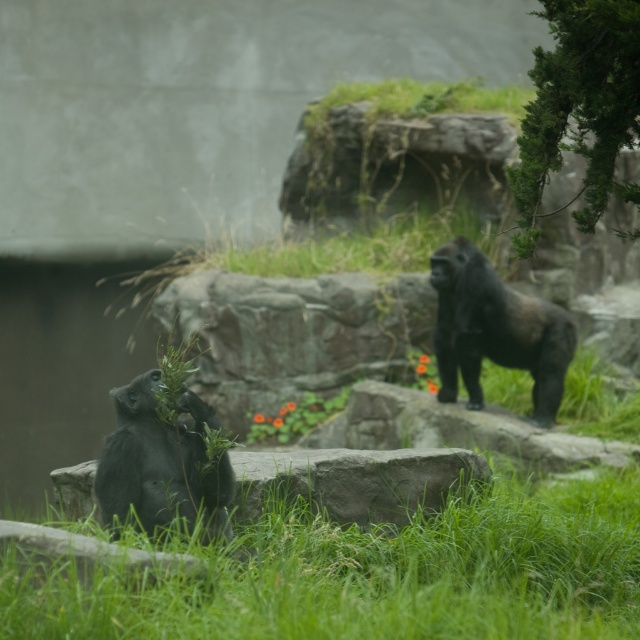
Question: Which object appears closest to the camera in this image?

Choices:
 (A) green grass at lower center
 (B) green textured bush at upper right

Answer: (A)

Question: Does gray rock at center appear on the right side of shiny black gorilla at upper right?

Choices:
 (A) yes
 (B) no

Answer: (B)

Question: Which is nearer to the gray rock at center?

Choices:
 (A) shiny black ape at lower left
 (B) green grass at lower center

Answer: (A)

Question: Among these objects, which one is farthest from the camera?

Choices:
 (A) shiny black gorilla at upper right
 (B) shiny black ape at lower left
 (C) gray rock at center
 (D) green textured bush at upper right

Answer: (A)

Question: Does green textured bush at upper right have a smaller size compared to gray rock at center?

Choices:
 (A) yes
 (B) no

Answer: (B)

Question: Observing the image, what is the correct spatial positioning of green grass at lower center in reference to gray rock at center?

Choices:
 (A) above
 (B) below

Answer: (B)